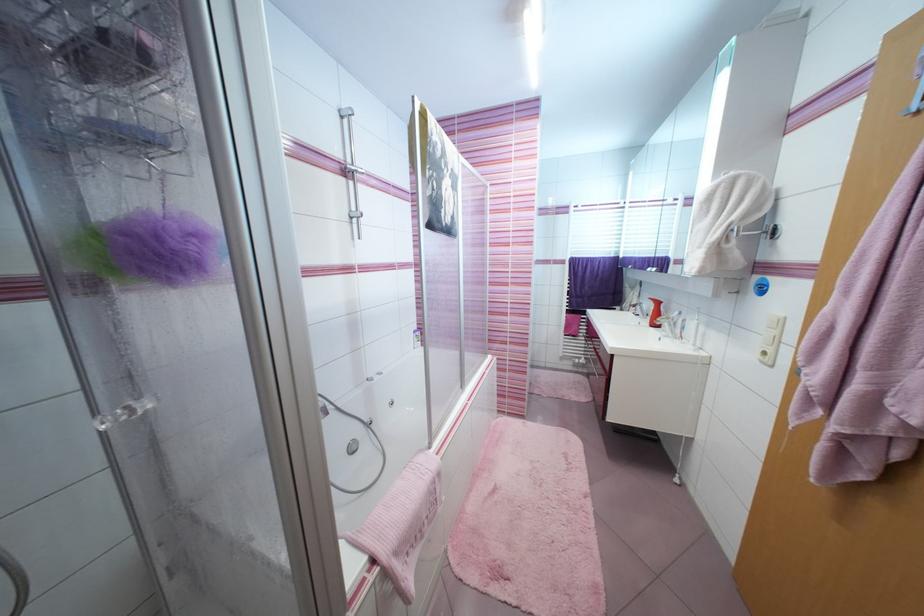
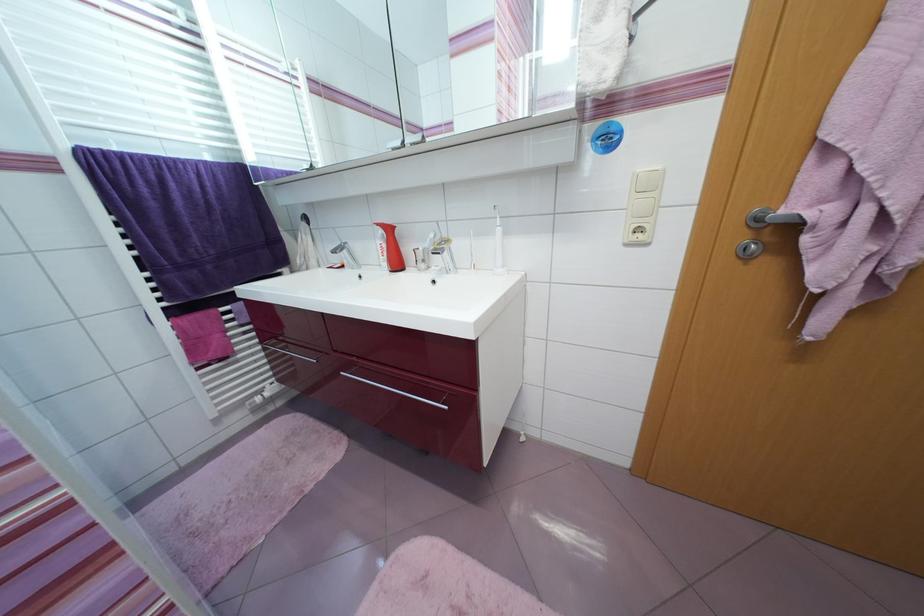
In the second image, find the point that corresponds to point (638, 307) in the first image.

(338, 254)